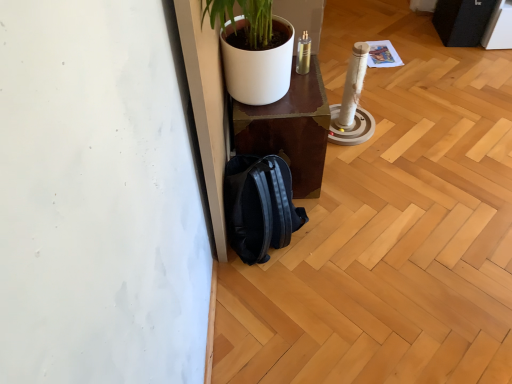
Question: Can you confirm if shiny brown table at center is wider than black matte backpack at lower center?

Choices:
 (A) no
 (B) yes

Answer: (B)

Question: Is shiny brown table at center looking in the opposite direction of black matte backpack at lower center?

Choices:
 (A) no
 (B) yes

Answer: (A)

Question: Is shiny brown table at center shorter than black matte backpack at lower center?

Choices:
 (A) no
 (B) yes

Answer: (A)

Question: From the image's perspective, does shiny brown table at center appear higher than black matte backpack at lower center?

Choices:
 (A) no
 (B) yes

Answer: (B)

Question: Is shiny brown table at center further to camera compared to black matte backpack at lower center?

Choices:
 (A) no
 (B) yes

Answer: (B)

Question: Considering the relative sizes of shiny brown table at center and black matte backpack at lower center in the image provided, is shiny brown table at center thinner than black matte backpack at lower center?

Choices:
 (A) yes
 (B) no

Answer: (B)

Question: Is black matte backpack at lower center in contact with shiny brown table at center?

Choices:
 (A) no
 (B) yes

Answer: (A)

Question: From a real-world perspective, is black matte backpack at lower center on shiny brown table at center?

Choices:
 (A) yes
 (B) no

Answer: (B)

Question: From the image's perspective, is black matte backpack at lower center above shiny brown table at center?

Choices:
 (A) no
 (B) yes

Answer: (A)

Question: Can you confirm if black matte backpack at lower center is wider than shiny brown table at center?

Choices:
 (A) yes
 (B) no

Answer: (B)

Question: Can you confirm if black matte backpack at lower center is smaller than shiny brown table at center?

Choices:
 (A) yes
 (B) no

Answer: (A)

Question: Does black matte backpack at lower center turn towards shiny brown table at center?

Choices:
 (A) no
 (B) yes

Answer: (A)

Question: In terms of height, does shiny brown table at center look taller or shorter compared to black matte backpack at lower center?

Choices:
 (A) tall
 (B) short

Answer: (A)